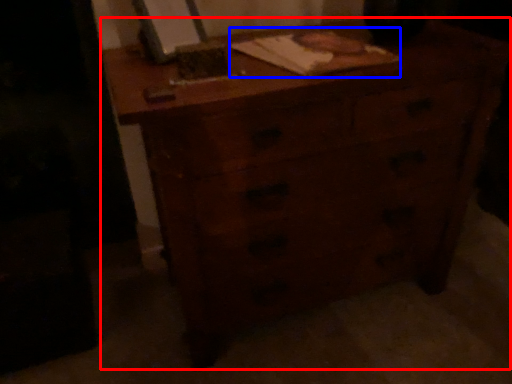
Question: Which of the following is the closest to the observer, chest of drawers (highlighted by a red box) or notebook (highlighted by a blue box)?

Choices:
 (A) chest of drawers
 (B) notebook

Answer: (A)